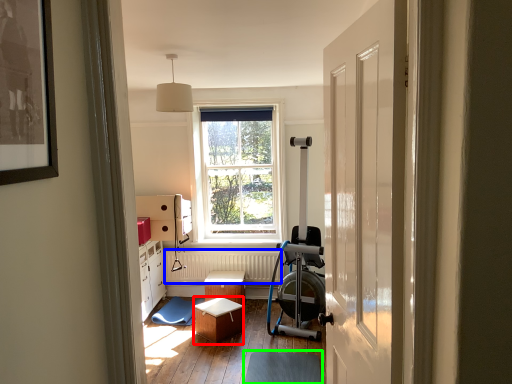
Question: Considering the real-world distances, which object is closest to stool (highlighted by a red box)? radiator (highlighted by a blue box) or footrest (highlighted by a green box).

Choices:
 (A) radiator
 (B) footrest

Answer: (B)